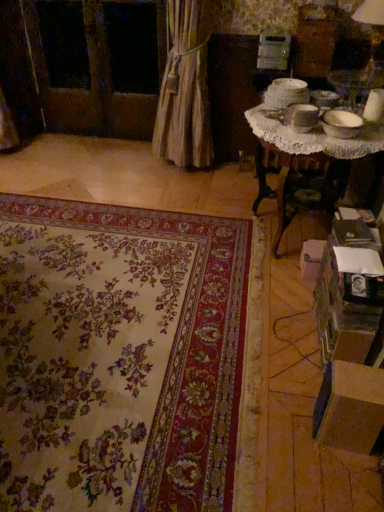
Locate an element on the screen. The image size is (384, 512). floral carpet at center is located at coordinates (120, 357).

This screenshot has height=512, width=384. What are the coordinates of `brown cardboard box at lower right, the 2th cardboard box positioned from the top` in the screenshot? It's located at (352, 403).

In order to face brown cardboard box at lower right, the 2th cardboard box viewed from the back, should I rotate leftwards or rightwards?

Turn right by 20.541 degrees to look at brown cardboard box at lower right, the 2th cardboard box viewed from the back.

Identify the location of transparent glass window at upper left. The height and width of the screenshot is (512, 384). (133, 46).

Are brown cardboard box at lower right, the 2th cardboard box positioned from the top, and white cardboard box at lower right, which is the 1th cardboard box in back-to-front order, located far from each other?

brown cardboard box at lower right, the 2th cardboard box positioned from the top, is near white cardboard box at lower right, which is the 1th cardboard box in back-to-front order, not far away.

Is point (335, 426) farther from camera compared to point (313, 274)?

No, (335, 426) is in front of (313, 274).

Does brown cardboard box at lower right, the 1th cardboard box from the bottom, turn towards white cardboard box at lower right, the 1th cardboard box positioned from the top?

No.

Does brown cardboard box at lower right, the 2th cardboard box positioned from the top, have a smaller size compared to white cardboard box at lower right, which is the second cardboard box from front to back?

Actually, brown cardboard box at lower right, the 2th cardboard box positioned from the top, might be larger than white cardboard box at lower right, which is the second cardboard box from front to back.

Is transparent glass window at upper left facing towards white lace table at upper right?

No, transparent glass window at upper left is not oriented towards white lace table at upper right.

From the image's perspective, is transparent glass window at upper left positioned above or below white lace table at upper right?

From the image's perspective, transparent glass window at upper left appears above white lace table at upper right.

In terms of width, does transparent glass window at upper left look wider or thinner when compared to white lace table at upper right?

Clearly, transparent glass window at upper left has less width compared to white lace table at upper right.

Find the location of a particular element. The width and height of the screenshot is (384, 512). window to the left of white lace table at upper right is located at coordinates (133, 46).

Is beige fabric curtain at left at the right side of white lace table at upper right?

No.

From the picture: Which of these two, beige fabric curtain at left or white lace table at upper right, is thinner?

beige fabric curtain at left.

At what (x,y) coordinates should I click in order to perform the action: click on table below the beige fabric curtain at left (from a real-world perspective). Please return your answer as a coordinate pair (x, y). The image size is (384, 512). Looking at the image, I should click on (305, 142).

From the image's perspective, between beige fabric curtain at left and white lace table at upper right, which one is located above?

beige fabric curtain at left is shown above in the image.

There is a transparent glass window at upper left. At what (x,y) coordinates should I click in order to perform the action: click on the 2nd cardboard box below it (from a real-world perspective). Please return your answer as a coordinate pair (x, y). Looking at the image, I should click on (311, 258).

Between point (112, 50) and point (309, 250), which one is positioned behind?

The point (112, 50) is more distant.

From a real-world perspective, is transparent glass window at upper left positioned above or below white cardboard box at lower right, which is the 1th cardboard box in back-to-front order?

Clearly, from a real-world perspective, transparent glass window at upper left is above white cardboard box at lower right, which is the 1th cardboard box in back-to-front order.

Considering the relative sizes of transparent glass window at upper left and white cardboard box at lower right, which is the second cardboard box from front to back, in the image provided, is transparent glass window at upper left shorter than white cardboard box at lower right, which is the second cardboard box from front to back,?

Incorrect, the height of transparent glass window at upper left does not fall short of that of white cardboard box at lower right, which is the second cardboard box from front to back.

Is matte white table lamp at upper right not within beige fabric curtain at left?

Indeed, matte white table lamp at upper right is completely outside beige fabric curtain at left.

Can you confirm if matte white table lamp at upper right is smaller than beige fabric curtain at left?

Yes.

Considering the positions of objects matte white table lamp at upper right and beige fabric curtain at left in the image provided, who is more to the right, matte white table lamp at upper right or beige fabric curtain at left?

matte white table lamp at upper right is more to the right.

Relative to beige fabric curtain at left, is matte white table lamp at upper right in front or behind?

Clearly, matte white table lamp at upper right is in front of beige fabric curtain at left.

Is white lace table at upper right smaller than white cardboard box at lower right, which is the second cardboard box from front to back?

Incorrect, white lace table at upper right is not smaller in size than white cardboard box at lower right, which is the second cardboard box from front to back.

Is white lace table at upper right aimed at white cardboard box at lower right, the 2th cardboard box when ordered from bottom to top?

No, white lace table at upper right is not turned towards white cardboard box at lower right, the 2th cardboard box when ordered from bottom to top.

Which is nearer, (308, 275) or (338, 142)?

Point (308, 275) is positioned farther from the camera compared to point (338, 142).

Looking at their sizes, would you say white cardboard box at lower right, the 2th cardboard box when ordered from bottom to top, is wider or thinner than white lace table at upper right?

In the image, white cardboard box at lower right, the 2th cardboard box when ordered from bottom to top, appears to be more narrow than white lace table at upper right.

Is white cardboard box at lower right, which is the second cardboard box from front to back, to the left of white lace table at upper right from the viewer's perspective?

Yes, white cardboard box at lower right, which is the second cardboard box from front to back, is to the left of white lace table at upper right.

Is white cardboard box at lower right, the 1th cardboard box positioned from the top, positioned with its back to white lace table at upper right?

No, white lace table at upper right is not at the back of white cardboard box at lower right, the 1th cardboard box positioned from the top.

This screenshot has width=384, height=512. Find the location of `cardboard box that appears below the brown cardboard box at lower right, the 2th cardboard box positioned from the top (from a real-world perspective)`. cardboard box that appears below the brown cardboard box at lower right, the 2th cardboard box positioned from the top (from a real-world perspective) is located at coordinates (311, 258).

The width and height of the screenshot is (384, 512). What are the coordinates of `window behind the white lace table at upper right` in the screenshot? It's located at (133, 46).

Which object lies further to the anchor point transparent glass window at upper left, floral carpet at center or brown cardboard box at lower right, the 1th cardboard box from the bottom?

Based on the image, brown cardboard box at lower right, the 1th cardboard box from the bottom, appears to be further to transparent glass window at upper left.

Looking at the image, which one is located further to brown cardboard box at lower right, the 1th cardboard box from the bottom, floral carpet at center or white lace table at upper right?

white lace table at upper right is further to brown cardboard box at lower right, the 1th cardboard box from the bottom.

Which object lies further to the anchor point floral carpet at center, white cardboard box at lower right, the 2th cardboard box when ordered from bottom to top, or beige fabric curtain at left?

beige fabric curtain at left.

When comparing their distances from transparent glass window at upper left, does beige fabric curtain at left or floral carpet at center seem further?

floral carpet at center.

When comparing their distances from brown cardboard box at lower right, the 1th cardboard box from the bottom, does transparent glass window at upper left or beige fabric curtain at left seem further?

The object further to brown cardboard box at lower right, the 1th cardboard box from the bottom, is transparent glass window at upper left.

From the image, which object appears to be nearer to brown cardboard box at lower right, the 2th cardboard box positioned from the top, white lace table at upper right or matte white table lamp at upper right?

white lace table at upper right lies closer to brown cardboard box at lower right, the 2th cardboard box positioned from the top, than the other object.

Based on the photo, considering their positions, is matte white table lamp at upper right positioned closer to transparent glass window at upper left than brown cardboard box at lower right, marked as the 1th cardboard box in a front-to-back arrangement?

The object closer to transparent glass window at upper left is matte white table lamp at upper right.

Which object lies nearer to the anchor point beige fabric curtain at left, brown cardboard box at lower right, the 1th cardboard box from the bottom, or white cardboard box at lower right, the 2th cardboard box when ordered from bottom to top?

white cardboard box at lower right, the 2th cardboard box when ordered from bottom to top.

This screenshot has height=512, width=384. I want to click on curtain that lies between transparent glass window at upper left and brown cardboard box at lower right, marked as the 1th cardboard box in a front-to-back arrangement, from top to bottom, so click(185, 88).

Find the location of a particular element. This screenshot has width=384, height=512. curtain between matte white table lamp at upper right and white cardboard box at lower right, which is the 1th cardboard box in back-to-front order, vertically is located at coordinates (185, 88).

You are a GUI agent. You are given a task and a screenshot of the screen. Output one action in this format:
    pyautogui.click(x=<x>, y=<y>)
    Task: Click on the cardboard box between beige fabric curtain at left and brown cardboard box at lower right, the 2th cardboard box positioned from the top, in the up-down direction
    The image size is (384, 512).
    Given the screenshot: What is the action you would take?
    pyautogui.click(x=311, y=258)

At what (x,y) coordinates should I click in order to perform the action: click on mat between matte white table lamp at upper right and brown cardboard box at lower right, the 2th cardboard box positioned from the top, from top to bottom. Please return your answer as a coordinate pair (x, y). The image size is (384, 512). Looking at the image, I should click on (120, 357).